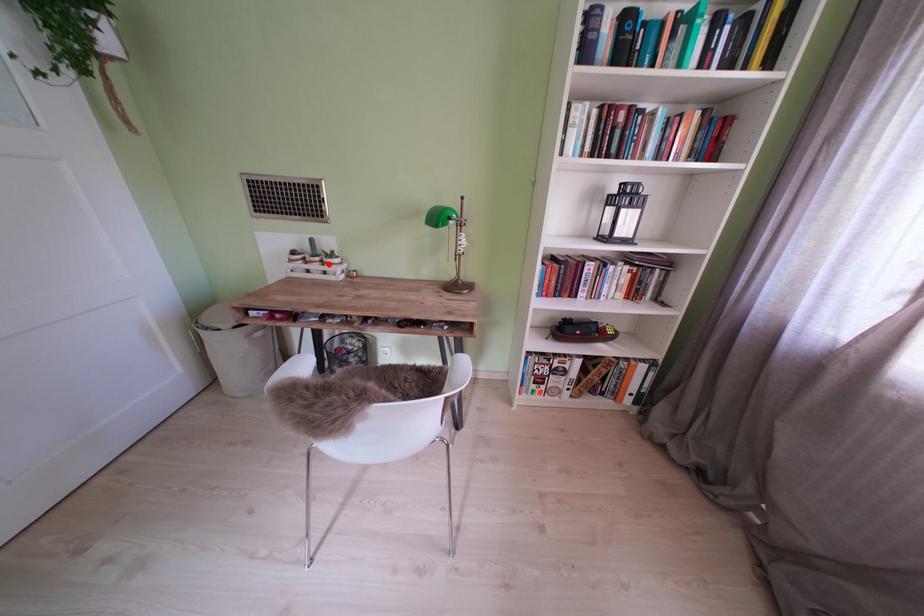
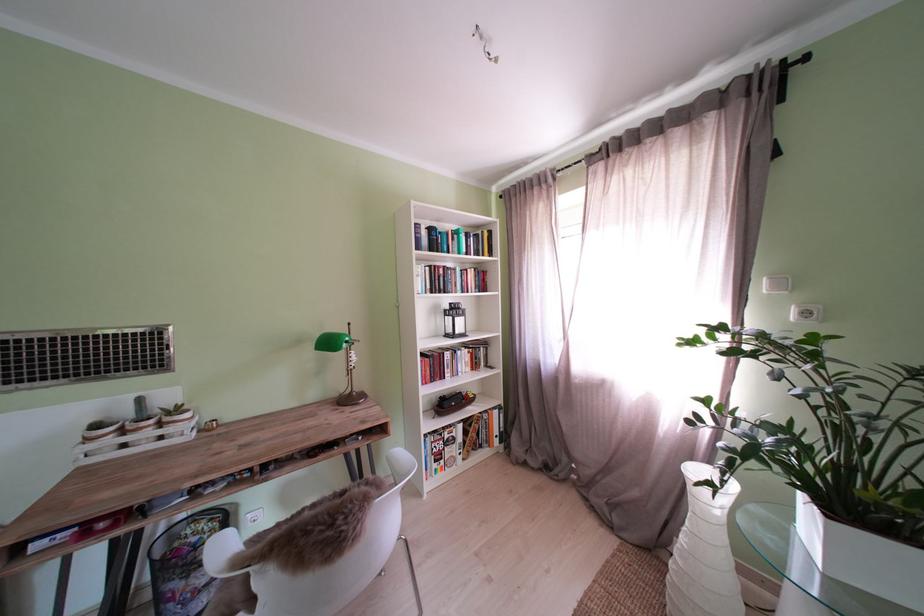
Find the pixel in the second image that matches the highlighted location in the first image.

(163, 427)